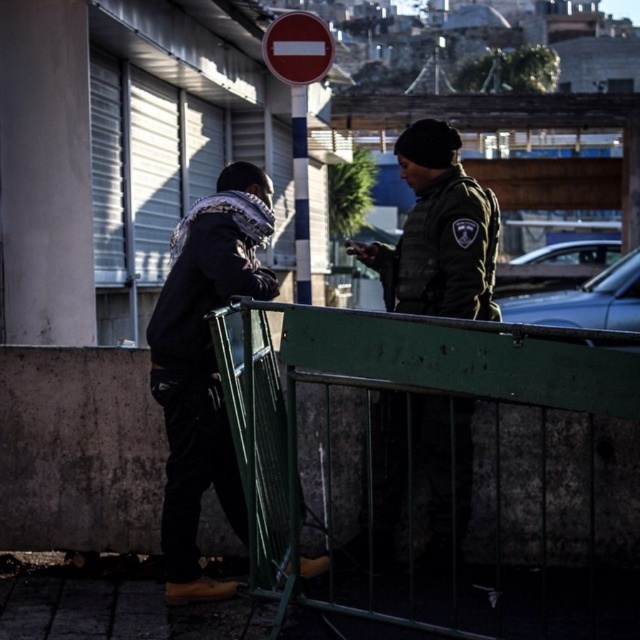
Question: Which object appears closest to the camera in this image?

Choices:
 (A) green metal fence at center
 (B) red matte sign at upper center
 (C) green matte uniform at center

Answer: (A)

Question: Based on their relative distances, which object is nearer to the green matte uniform at center?

Choices:
 (A) red matte sign at upper center
 (B) green metal fence at center

Answer: (B)

Question: Does green metal fence at center have a smaller size compared to green matte uniform at center?

Choices:
 (A) yes
 (B) no

Answer: (B)

Question: Can you confirm if green metal fence at center is wider than red matte sign at upper center?

Choices:
 (A) yes
 (B) no

Answer: (A)

Question: Among these objects, which one is nearest to the camera?

Choices:
 (A) red matte sign at upper center
 (B) green matte uniform at center
 (C) green metal fence at center

Answer: (C)

Question: Is green metal fence at center smaller than green matte uniform at center?

Choices:
 (A) no
 (B) yes

Answer: (A)